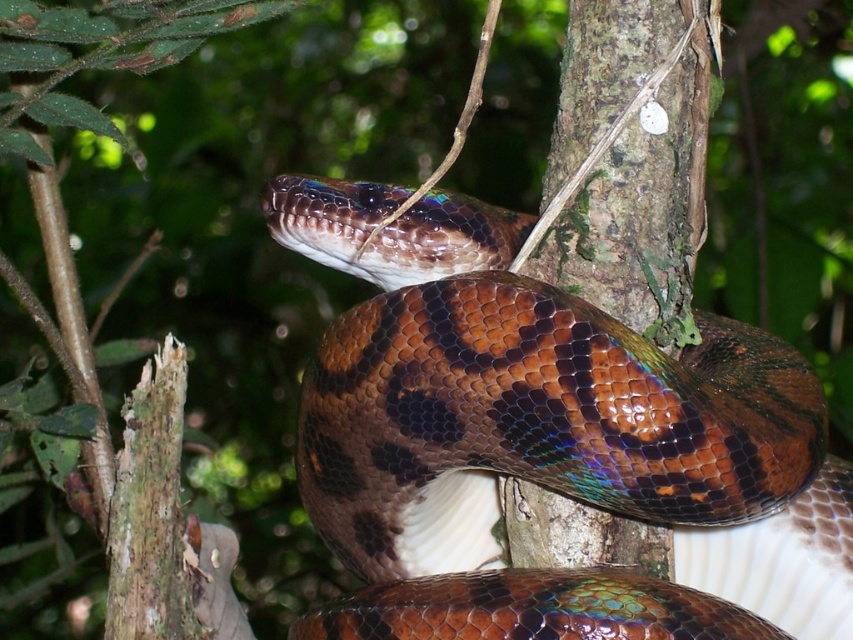
Is point (352, 412) more distant than point (677, 109)?

No.

Does shiny brown snake at center have a larger size compared to green mossy bark at center?

Correct, shiny brown snake at center is larger in size than green mossy bark at center.

Which is in front, point (392, 540) or point (635, 112)?

Point (635, 112)

The height and width of the screenshot is (640, 853). I want to click on shiny brown snake at center, so click(547, 442).